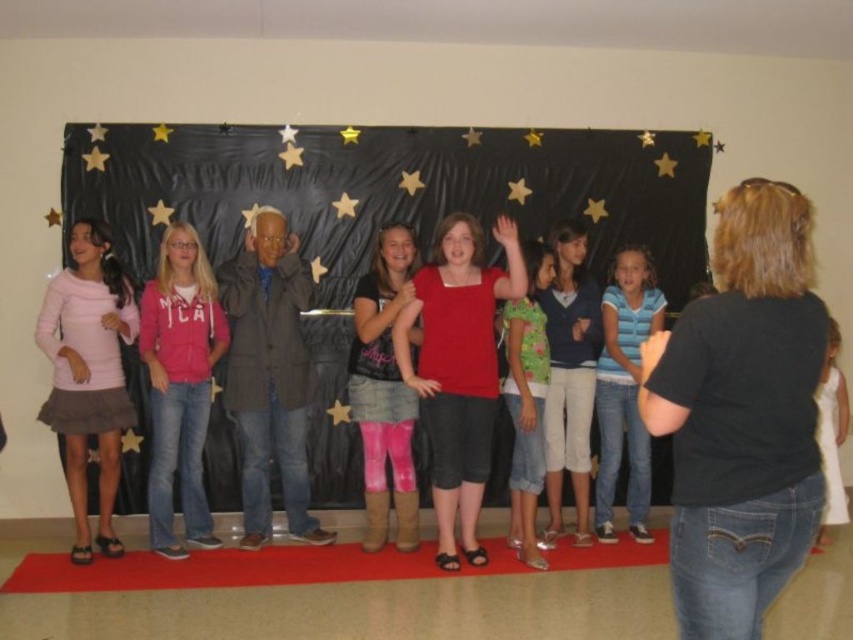
Question: Does dark gray textured coat at center have a larger size compared to white satin dress at center?

Choices:
 (A) no
 (B) yes

Answer: (B)

Question: Can you confirm if black t-shirt at right is positioned below denim shorts at center?

Choices:
 (A) yes
 (B) no

Answer: (B)

Question: Among these objects, which one is farthest from the camera?

Choices:
 (A) matte red shirt at center
 (B) green denim shorts at center

Answer: (B)

Question: Among these points, which one is nearest to the camera?

Choices:
 (A) (352, 307)
 (B) (763, 307)
 (C) (576, 540)
 (D) (180, 388)

Answer: (B)

Question: Which object is the farthest from the black t-shirt at right?

Choices:
 (A) pink tie-dye leggings at center
 (B) green denim shorts at center
 (C) dark gray textured coat at center

Answer: (C)

Question: Does black t-shirt at right have a lesser width compared to blue denim jeans at center?

Choices:
 (A) yes
 (B) no

Answer: (B)